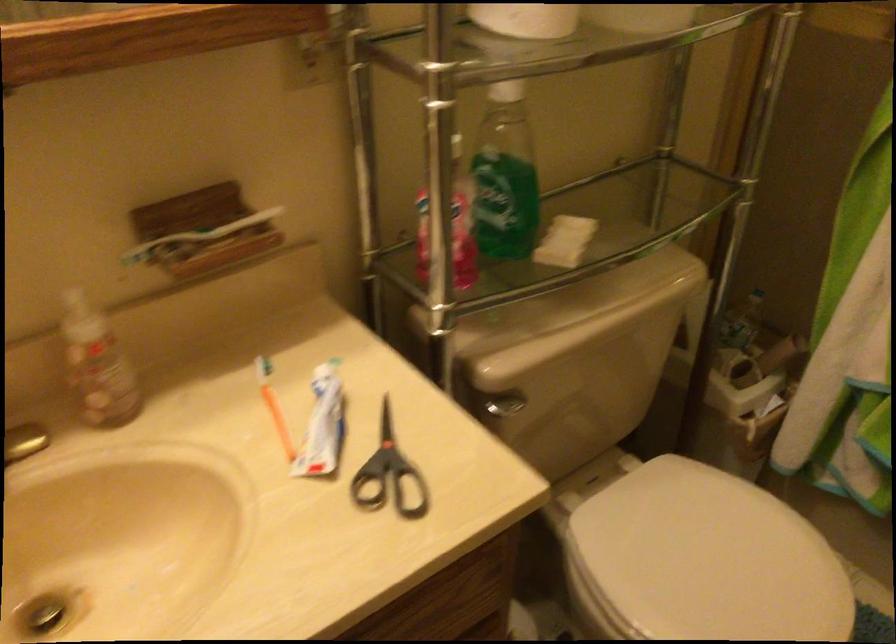
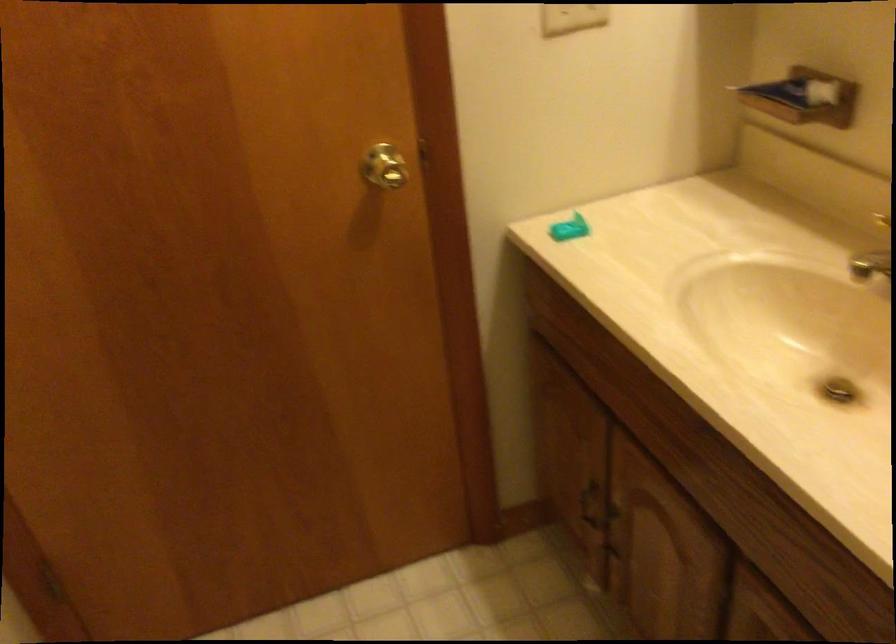
First-person continuous shooting, in which direction is the camera rotating?

The camera's rotation is toward left-down.